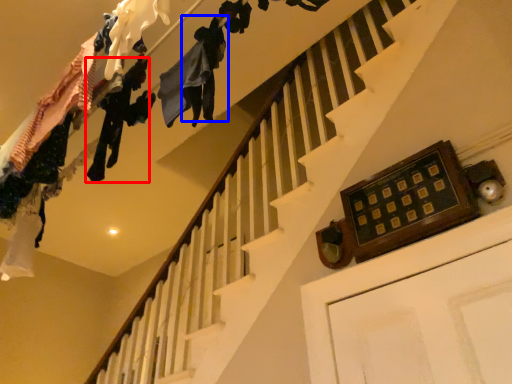
Question: Which point is further to the camera, clothing (highlighted by a red box) or clothing (highlighted by a blue box)?

Choices:
 (A) clothing
 (B) clothing

Answer: (A)